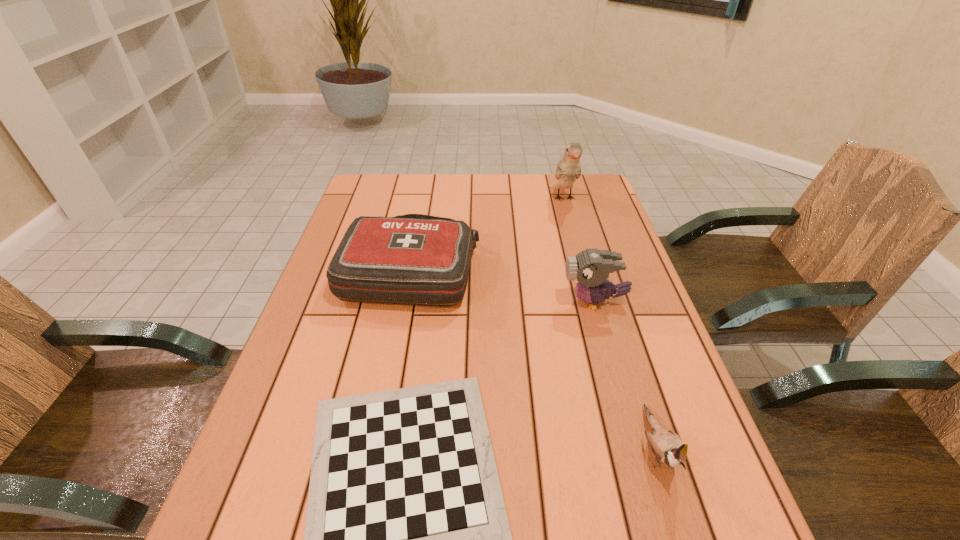
Find the location of a particular element. This screenshot has height=540, width=960. the tallest bird is located at coordinates (568, 169).

The width and height of the screenshot is (960, 540). Identify the location of the farthest bird. (568, 169).

At what (x,y) coordinates should I click in order to perform the action: click on the second shortest bird. Please return your answer as a coordinate pair (x, y). Looking at the image, I should click on (591, 267).

Locate an element on the screen. This screenshot has height=540, width=960. the second tallest object is located at coordinates point(591,267).

This screenshot has height=540, width=960. I want to click on the first-aid kit, so click(414, 259).

Where is `the nearest bird`? The height and width of the screenshot is (540, 960). the nearest bird is located at coordinates (666, 445).

Identify the location of free space located at the face of the tallest bird. Image resolution: width=960 pixels, height=540 pixels. pyautogui.click(x=585, y=271).

This screenshot has width=960, height=540. In order to click on free region located at the beak of the fourth shortest object in this screenshot , I will do `click(498, 302)`.

The width and height of the screenshot is (960, 540). What are the coordinates of `free space located at the beak of the fourth shortest object` in the screenshot? It's located at (458, 302).

You are a GUI agent. You are given a task and a screenshot of the screen. Output one action in this format:
    pyautogui.click(x=<x>, y=<y>)
    Task: Click on the vacant area situated 0.300m at the beak of the fourth shortest object
    Image resolution: width=960 pixels, height=540 pixels.
    Given the screenshot: What is the action you would take?
    pyautogui.click(x=443, y=302)